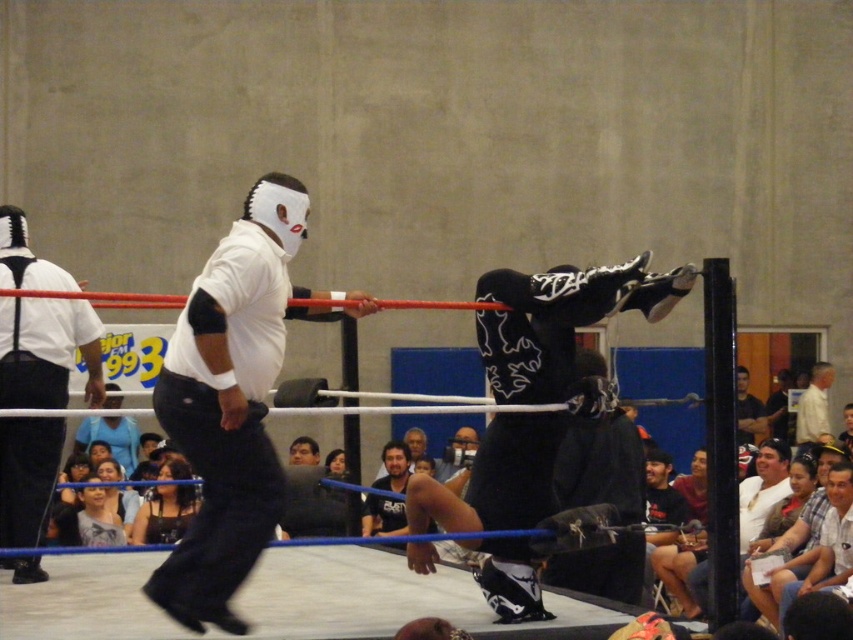
Between white matte mask at upper center and dark blue jeans at center, which one has less height?

With less height is white matte mask at upper center.

Who is positioned more to the right, white matte mask at upper center or dark blue jeans at center?

Positioned to the right is dark blue jeans at center.

The image size is (853, 640). I want to click on white matte mask at upper center, so click(x=233, y=401).

You are a GUI agent. You are given a task and a screenshot of the screen. Output one action in this format:
    pyautogui.click(x=<x>, y=<y>)
    Task: Click on the white matte mask at upper center
    This screenshot has width=853, height=640.
    Given the screenshot: What is the action you would take?
    pyautogui.click(x=233, y=401)

Is point (91, 544) closer to viewer compared to point (821, 381)?

Yes, point (91, 544) is closer to viewer.

Which is in front, point (115, 525) or point (807, 404)?

Point (115, 525)

Does point (78, 528) lie behind point (807, 432)?

No, (78, 528) is closer to viewer.

Identify the location of light blue fabric at lower left. The width and height of the screenshot is (853, 640). (97, 518).

Which is more to the left, black matte mask at center or white shirt at upper center?

Positioned to the left is black matte mask at center.

Is point (544, 472) closer to camera compared to point (817, 378)?

Yes, it is.

Identify the location of black matte mask at center. (537, 385).